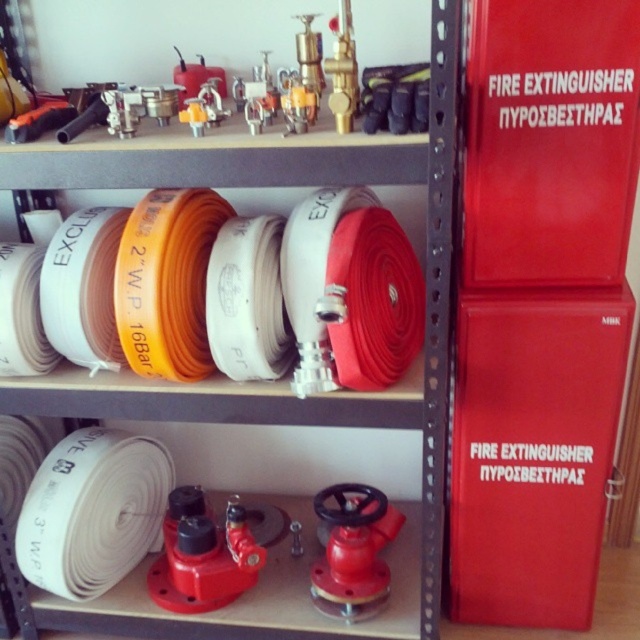
You are a firefighter who needs to grab both the red matte fire extinguisher at right and the white rubber hose at upper center. How far apart are these two items?

The red matte fire extinguisher at right is 10.68 inches away from the white rubber hose at upper center.

You are a firefighter needing to grab both the red matte fire extinguisher at center right and the white rubber hose at upper center. Can you reach both items without moving your position if your arm span is 1.5 meters?

The distance between the red matte fire extinguisher at center right and the white rubber hose at upper center is 24.86 centimeters. Since your arm span is 1.5 meters, which is much wider than the distance between them, you can easily reach both items without moving.